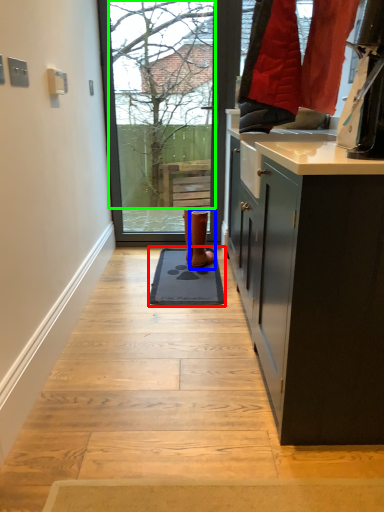
Question: Which object is the closest to the doormat (highlighted by a red box)? Choose among these: footwear (highlighted by a blue box) or tree (highlighted by a green box).

Choices:
 (A) footwear
 (B) tree

Answer: (A)